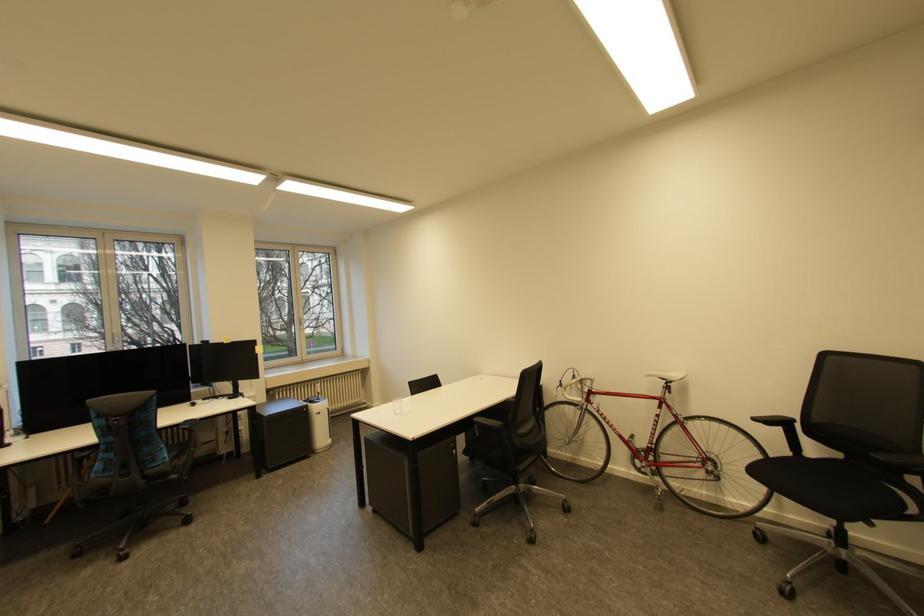
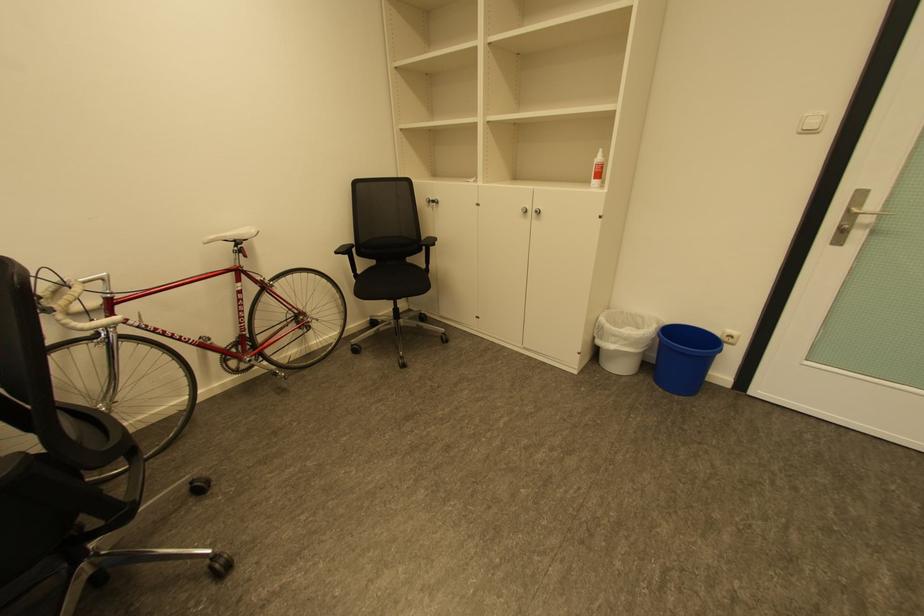
In the second image, find the point that corresponds to (x=845, y=456) in the first image.

(380, 262)